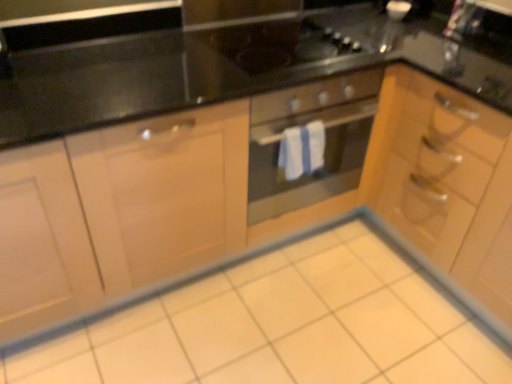
Question: From the image's perspective, is stainless steel oven at center located beneath black glass gas stove at center?

Choices:
 (A) no
 (B) yes

Answer: (B)

Question: Is black glass gas stove at center inside stainless steel oven at center?

Choices:
 (A) no
 (B) yes

Answer: (A)

Question: Considering the relative positions of stainless steel oven at center and black glass gas stove at center in the image provided, is stainless steel oven at center to the left of black glass gas stove at center from the viewer's perspective?

Choices:
 (A) no
 (B) yes

Answer: (A)

Question: From a real-world perspective, is stainless steel oven at center under black glass gas stove at center?

Choices:
 (A) no
 (B) yes

Answer: (B)

Question: Is stainless steel oven at center further to the viewer compared to black glass gas stove at center?

Choices:
 (A) yes
 (B) no

Answer: (B)

Question: Is stainless steel oven at center oriented away from black glass gas stove at center?

Choices:
 (A) yes
 (B) no

Answer: (B)

Question: Is wooden cabinet at right positioned far away from white glossy tile at center?

Choices:
 (A) yes
 (B) no

Answer: (B)

Question: Is wooden cabinet at right directly adjacent to white glossy tile at center?

Choices:
 (A) yes
 (B) no

Answer: (B)

Question: From a real-world perspective, is wooden cabinet at right below white glossy tile at center?

Choices:
 (A) no
 (B) yes

Answer: (A)

Question: From a real-world perspective, is wooden cabinet at right on white glossy tile at center?

Choices:
 (A) yes
 (B) no

Answer: (A)

Question: Considering the relative positions of wooden cabinet at right and white glossy tile at center in the image provided, is wooden cabinet at right to the right of white glossy tile at center from the viewer's perspective?

Choices:
 (A) no
 (B) yes

Answer: (B)

Question: Is wooden cabinet at right thinner than white glossy tile at center?

Choices:
 (A) yes
 (B) no

Answer: (A)

Question: Considering the relative sizes of black glass gas stove at center and stainless steel oven at center in the image provided, is black glass gas stove at center bigger than stainless steel oven at center?

Choices:
 (A) no
 (B) yes

Answer: (A)